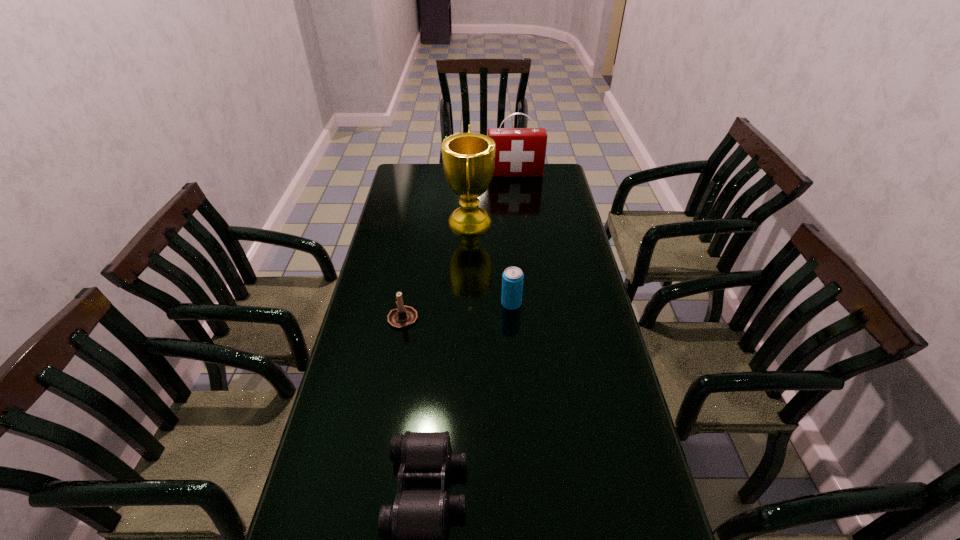
Image resolution: width=960 pixels, height=540 pixels. Find the location of `vacant region between the award and the second tallest object`. vacant region between the award and the second tallest object is located at coordinates (492, 198).

Where is `free space between the candle holder and the soda can`? The height and width of the screenshot is (540, 960). free space between the candle holder and the soda can is located at coordinates (457, 310).

Where is `free area in between the candle holder and the soda can`? free area in between the candle holder and the soda can is located at coordinates (457, 310).

The width and height of the screenshot is (960, 540). What are the coordinates of `object that is the closest one to the second shortest object` in the screenshot? It's located at (512, 278).

I want to click on object that stands as the third closest to the soda can, so click(x=417, y=522).

This screenshot has width=960, height=540. Find the location of `free region that satisfies the following two spatial constraints: 1. on the shiny surface of the award; 2. on the left side of the soda can`. free region that satisfies the following two spatial constraints: 1. on the shiny surface of the award; 2. on the left side of the soda can is located at coordinates (468, 303).

Identify the location of vacant region that satisfies the following two spatial constraints: 1. on the front face of the first-aid kit; 2. on the shiny surface of the tallest object. (520, 221).